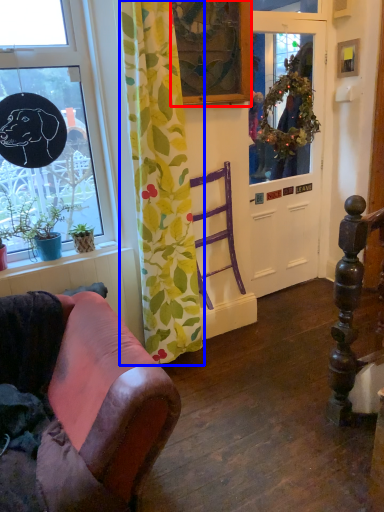
Question: Which object appears farthest to the camera in this image, picture frame (highlighted by a red box) or curtain (highlighted by a blue box)?

Choices:
 (A) picture frame
 (B) curtain

Answer: (A)